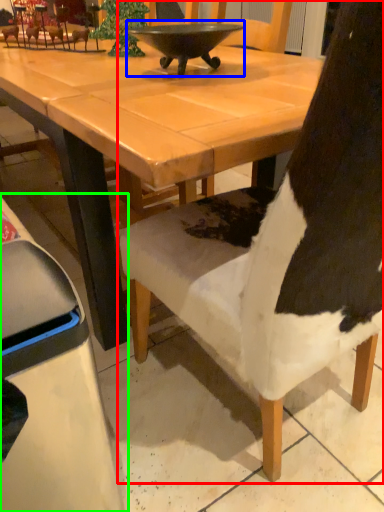
Question: Estimate the real-world distances between objects in this image. Which object is farther from chair (highlighted by a red box), bowl (highlighted by a blue box) or chair (highlighted by a green box)?

Choices:
 (A) bowl
 (B) chair

Answer: (A)